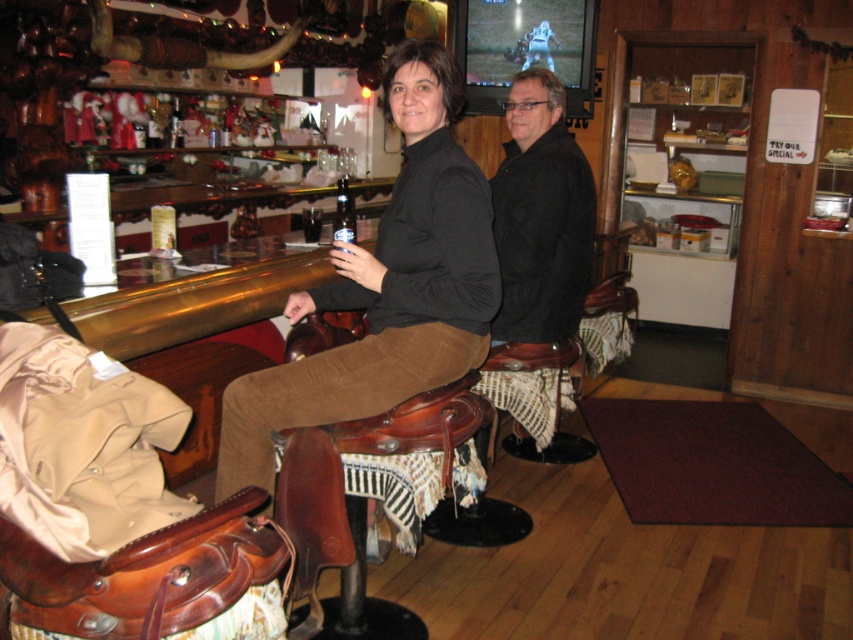
Between black matte jacket at center and clear glass bottle at center, which one has more height?

black matte jacket at center

Does black matte jacket at center have a greater width compared to clear glass bottle at center?

Answer: Yes.

You are a GUI agent. You are given a task and a screenshot of the screen. Output one action in this format:
    pyautogui.click(x=<x>, y=<y>)
    Task: Click on the black matte jacket at center
    This screenshot has width=853, height=640.
    Given the screenshot: What is the action you would take?
    pyautogui.click(x=540, y=216)

How distant is matte black jacket at center from black matte jacket at center?

matte black jacket at center and black matte jacket at center are 27.79 inches apart.

Who is more forward, (x=426, y=381) or (x=534, y=195)?

Point (x=426, y=381)

Identify the location of matte black jacket at center. This screenshot has height=640, width=853. (386, 285).

In order to click on matte black jacket at center in this screenshot , I will do `click(386, 285)`.

Does matte black jacket at center have a smaller size compared to clear glass bottle at center?

No.

Is matte black jacket at center further to camera compared to clear glass bottle at center?

Answer: No.

What do you see at coordinates (386, 285) in the screenshot?
I see `matte black jacket at center` at bounding box center [386, 285].

Where is `matte black jacket at center`? This screenshot has width=853, height=640. matte black jacket at center is located at coordinates (386, 285).